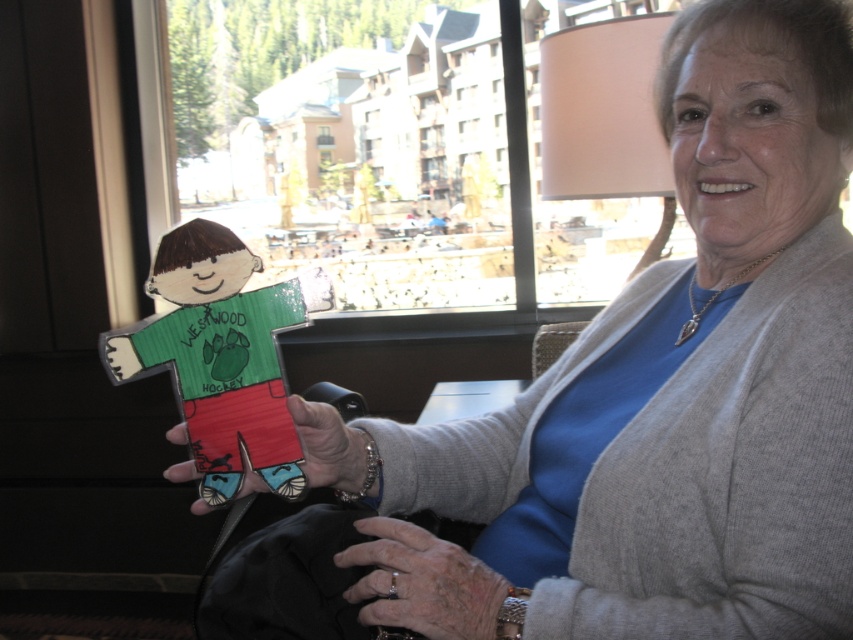
Is cardboard figure at center taller than silver metallic ring at lower center?

Yes.

At what (x,y) coordinates should I click in order to perform the action: click on cardboard figure at center. Please return your answer as a coordinate pair (x, y). This screenshot has width=853, height=640. Looking at the image, I should click on (221, 356).

The image size is (853, 640). Find the location of `cardboard figure at center`. cardboard figure at center is located at coordinates (221, 356).

Is cardboard figure at center positioned at the back of matte cardboard figure at center?

Yes.

Is cardboard figure at center to the right of matte cardboard figure at center from the viewer's perspective?

In fact, cardboard figure at center is to the left of matte cardboard figure at center.

Does point (202, 275) lie behind point (355, 477)?

That is False.

At what (x,y) coordinates should I click in order to perform the action: click on cardboard figure at center. Please return your answer as a coordinate pair (x, y). The width and height of the screenshot is (853, 640). Looking at the image, I should click on (221, 356).

Can you confirm if silver metallic ring at lower center is smaller than matte cardboard figure at center?

Yes.

Between point (419, 616) and point (291, 400), which one is positioned behind?

The point (291, 400) is more distant.

Locate an element on the screen. This screenshot has width=853, height=640. silver metallic ring at lower center is located at coordinates (421, 582).